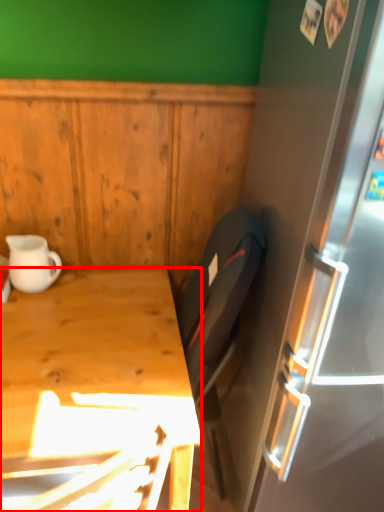
Question: From the image's perspective, what is the correct spatial positioning of desk (annotated by the red box) in reference to coffee cup?

Choices:
 (A) below
 (B) above

Answer: (A)